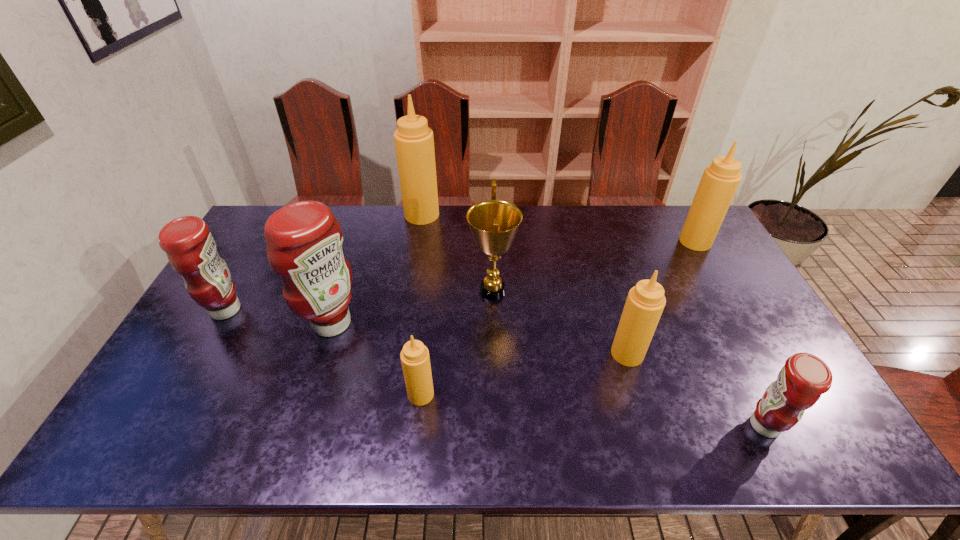
This screenshot has width=960, height=540. I want to click on free region that satisfies the following two spatial constraints: 1. on the back side of the third nearest tan condiment; 2. on the left side of the smallest tan condiment, so click(438, 241).

Where is `vacant point that satisfies the following two spatial constraints: 1. on the back side of the rightmost tan condiment; 2. on the left side of the seventh object from right to left`? This screenshot has height=540, width=960. vacant point that satisfies the following two spatial constraints: 1. on the back side of the rightmost tan condiment; 2. on the left side of the seventh object from right to left is located at coordinates (359, 241).

You are a GUI agent. You are given a task and a screenshot of the screen. Output one action in this format:
    pyautogui.click(x=<x>, y=<y>)
    Task: Click on the free space that satisfies the following two spatial constraints: 1. on the front side of the tallest condiment; 2. on the left side of the rightmost red condiment
    The width and height of the screenshot is (960, 540).
    Given the screenshot: What is the action you would take?
    pyautogui.click(x=387, y=426)

Find the location of `free space that satisfies the following two spatial constraints: 1. on the front view with handles of the award; 2. on the back side of the smallest red condiment`. free space that satisfies the following two spatial constraints: 1. on the front view with handles of the award; 2. on the back side of the smallest red condiment is located at coordinates (496, 426).